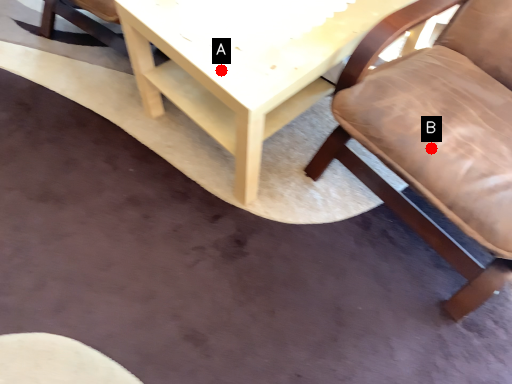
Question: Two points are circled on the image, labeled by A and B beside each circle. Which point is closer to the camera?

Choices:
 (A) A is closer
 (B) B is closer

Answer: (B)